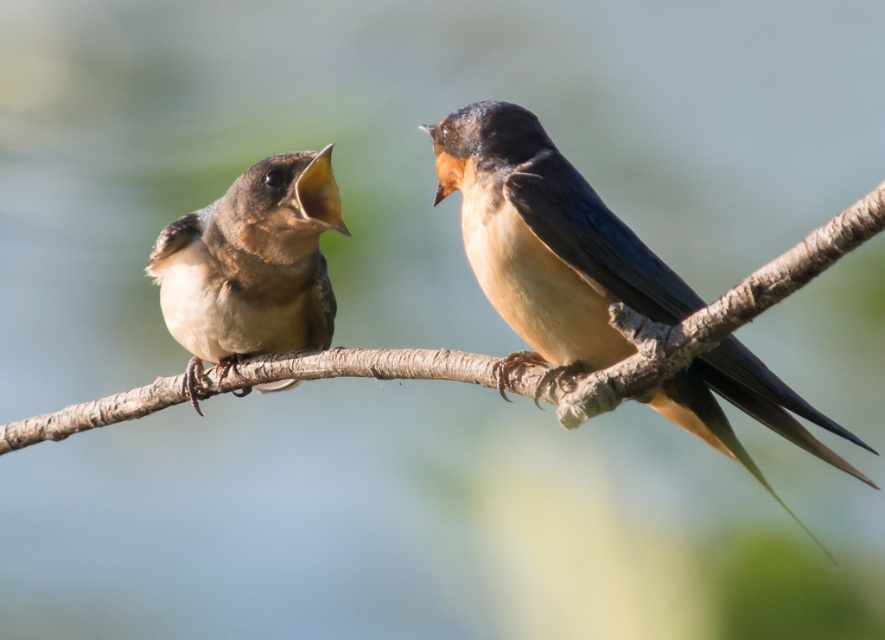
Question: Which point is closer to the camera?

Choices:
 (A) brown glossy swallow at right
 (B) brown textured branch at center
 (C) brown matte bird at left

Answer: (B)

Question: Estimate the real-world distances between objects in this image. Which object is closer to the brown matte bird at left?

Choices:
 (A) brown glossy swallow at right
 (B) brown textured branch at center

Answer: (B)

Question: Which object is farther from the camera taking this photo?

Choices:
 (A) brown textured branch at center
 (B) brown matte bird at left

Answer: (B)

Question: Is brown glossy swallow at right bigger than brown matte bird at left?

Choices:
 (A) yes
 (B) no

Answer: (A)

Question: Is brown glossy swallow at right bigger than brown textured branch at center?

Choices:
 (A) no
 (B) yes

Answer: (A)

Question: Does brown glossy swallow at right appear over brown textured branch at center?

Choices:
 (A) yes
 (B) no

Answer: (A)